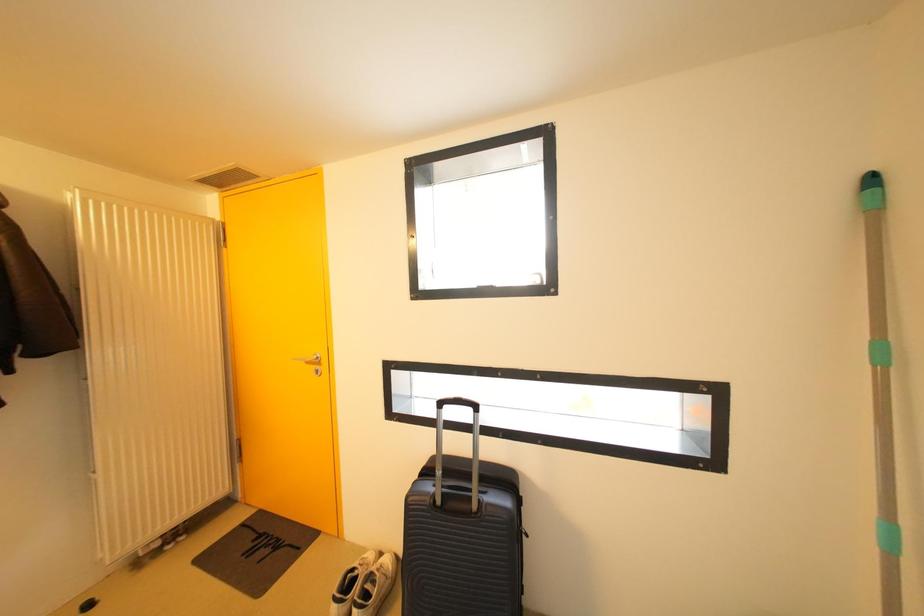
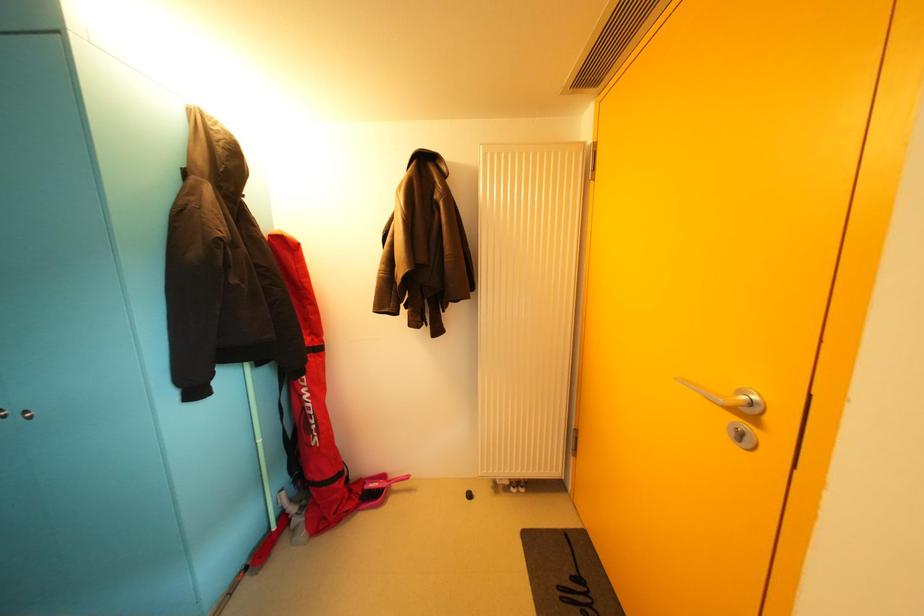
Question: The camera is either moving clockwise (left) or counter-clockwise (right) around the object. The first image is from the beginning of the video and the second image is from the end. Is the camera moving left or right when shooting the video?

Choices:
 (A) Left
 (B) Right

Answer: (B)